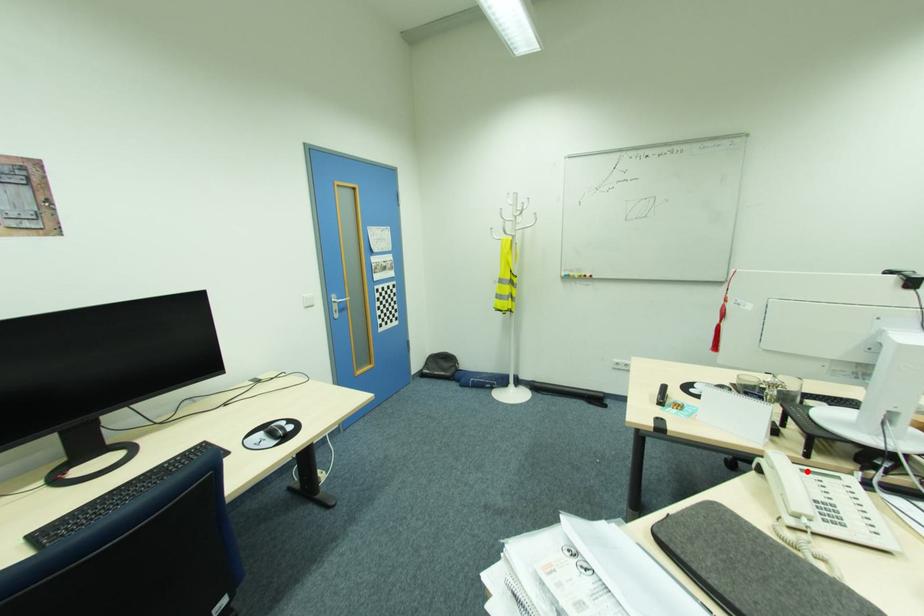
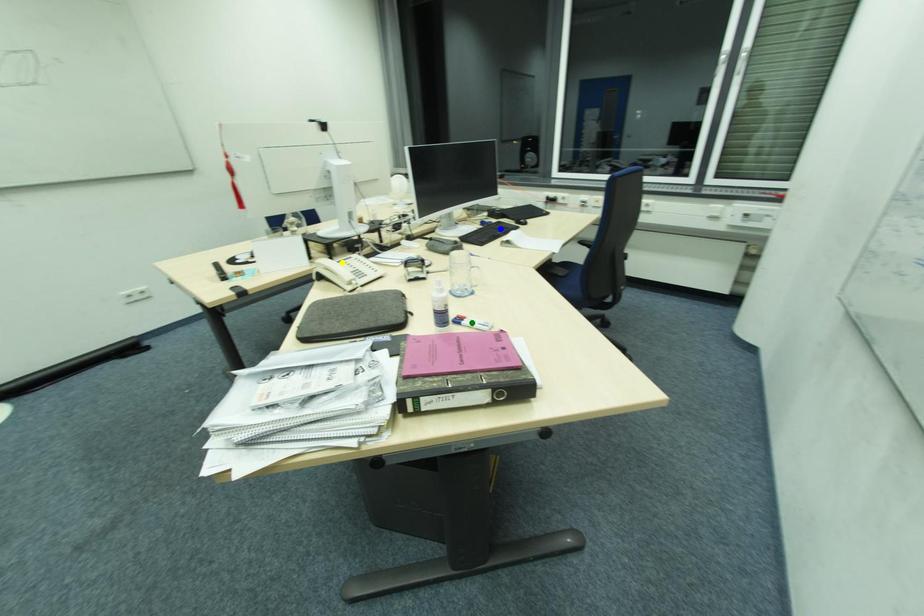
Question: I am providing you with two images of the same scene from different viewpoints. A red point is marked on the first image. You are given multiple points on the second image. Which spot in image 2 lines up with the point in image 1?

Choices:
 (A) yellow point
 (B) blue point
 (C) green point

Answer: (A)